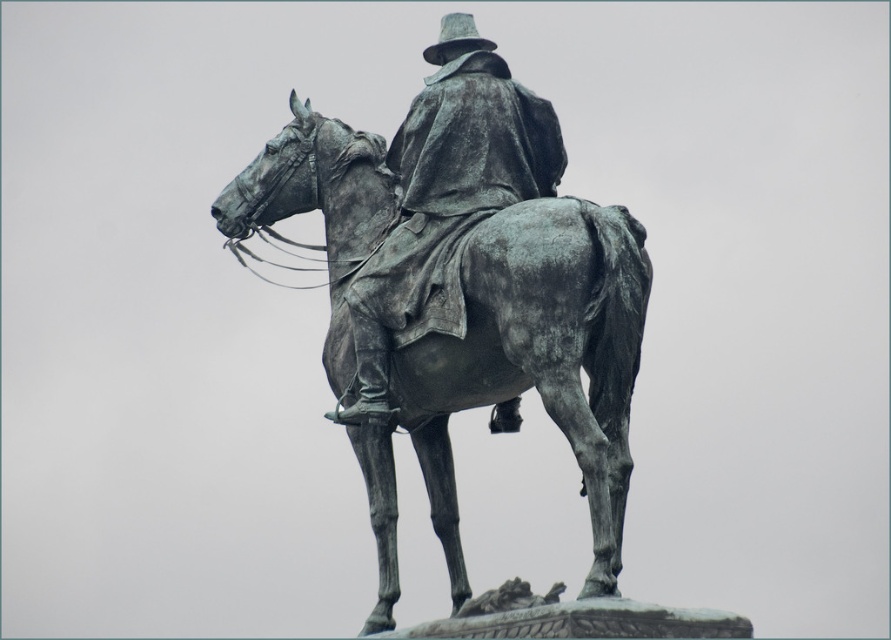
Does bronze statue horse at center have a lesser height compared to bronze statue at center?

No.

Can you confirm if bronze statue horse at center is thinner than bronze statue at center?

No.

Which is in front, point (291, 93) or point (431, 273)?

Positioned in front is point (431, 273).

Locate an element on the screen. The image size is (891, 640). bronze statue horse at center is located at coordinates (538, 356).